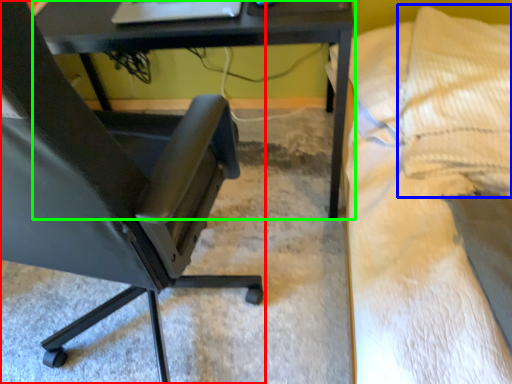
Question: Considering the real-world distances, which object is farthest from chair (highlighted by a red box)? pillow (highlighted by a blue box) or table (highlighted by a green box)?

Choices:
 (A) pillow
 (B) table

Answer: (A)